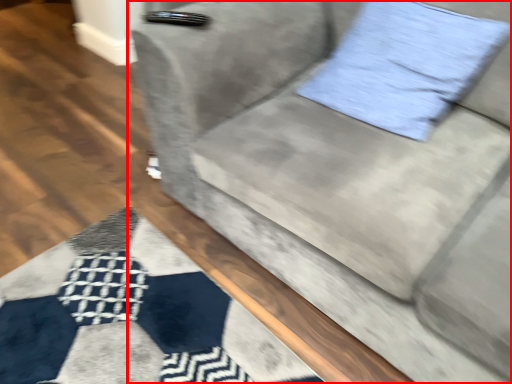
Question: From the image, what is the correct spatial relationship of studio couch (annotated by the red box) in relation to pillow?

Choices:
 (A) right
 (B) left

Answer: (B)